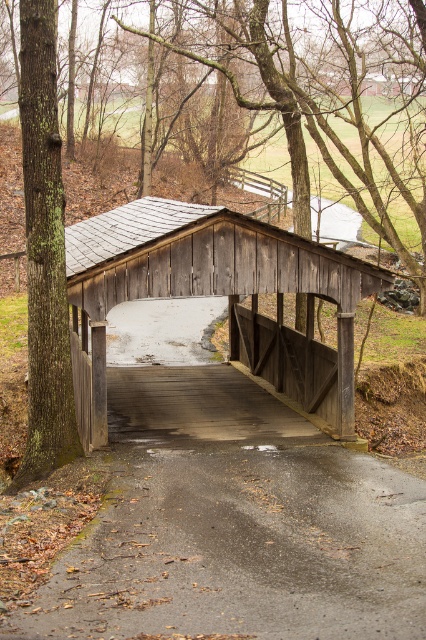
Question: Which of the following is the farthest from the observer?

Choices:
 (A) smooth asphalt path at center
 (B) wooden bridge at center
 (C) green mossy bark tree at left

Answer: (B)

Question: Is smooth asphalt path at center to the left of green mossy bark tree at left from the viewer's perspective?

Choices:
 (A) no
 (B) yes

Answer: (A)

Question: Does smooth asphalt path at center appear on the left side of green mossy bark tree at left?

Choices:
 (A) no
 (B) yes

Answer: (A)

Question: Which is nearer to the wooden bridge at center?

Choices:
 (A) smooth asphalt path at center
 (B) green mossy bark tree at left

Answer: (A)

Question: Considering the relative positions of smooth asphalt path at center and green mossy bark tree at left in the image provided, where is smooth asphalt path at center located with respect to green mossy bark tree at left?

Choices:
 (A) right
 (B) left

Answer: (A)

Question: Which of the following is the farthest from the observer?

Choices:
 (A) (236, 429)
 (B) (25, 150)

Answer: (A)